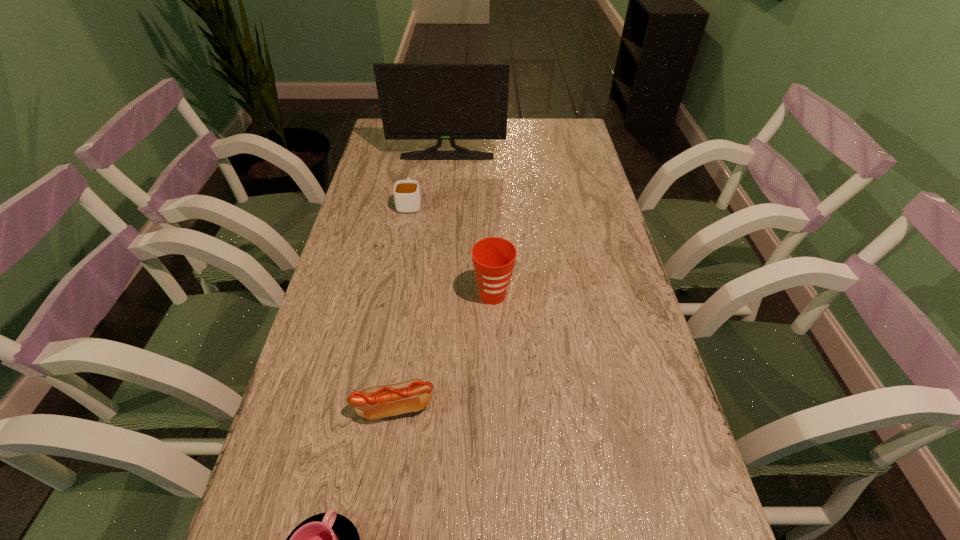
Where is `vacant space situated 0.170m on the side with the handle of the fourth nearest object`? vacant space situated 0.170m on the side with the handle of the fourth nearest object is located at coordinates (417, 163).

Identify the location of free space located 0.160m on the back of the sausage. (406, 326).

The height and width of the screenshot is (540, 960). I want to click on monitor present at the left edge, so click(x=418, y=101).

Where is `cup at the left edge`? cup at the left edge is located at coordinates (407, 198).

Identify the location of sausage situated at the left edge. This screenshot has width=960, height=540. (376, 402).

Where is `vacant space at the far edge of the desktop`? This screenshot has height=540, width=960. vacant space at the far edge of the desktop is located at coordinates coord(515,132).

The width and height of the screenshot is (960, 540). What are the coordinates of `vacant space at the left edge` in the screenshot? It's located at [x=341, y=328].

Where is `vacant position at the right edge of the desktop`? The image size is (960, 540). vacant position at the right edge of the desktop is located at coordinates (569, 194).

Where is `vacant space at the far left corner of the desktop`? vacant space at the far left corner of the desktop is located at coordinates (406, 151).

This screenshot has width=960, height=540. I want to click on free space that is in between the farthest object and the second farthest object, so click(x=428, y=180).